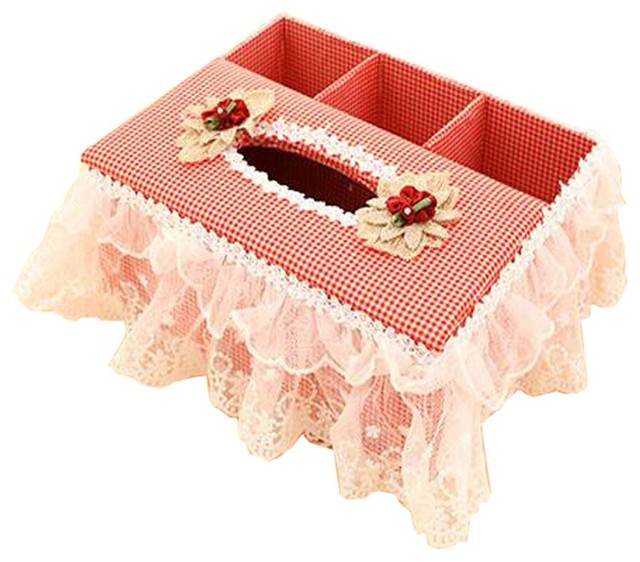
The image size is (640, 562). Find the location of `tray`. tray is located at coordinates (285, 66).